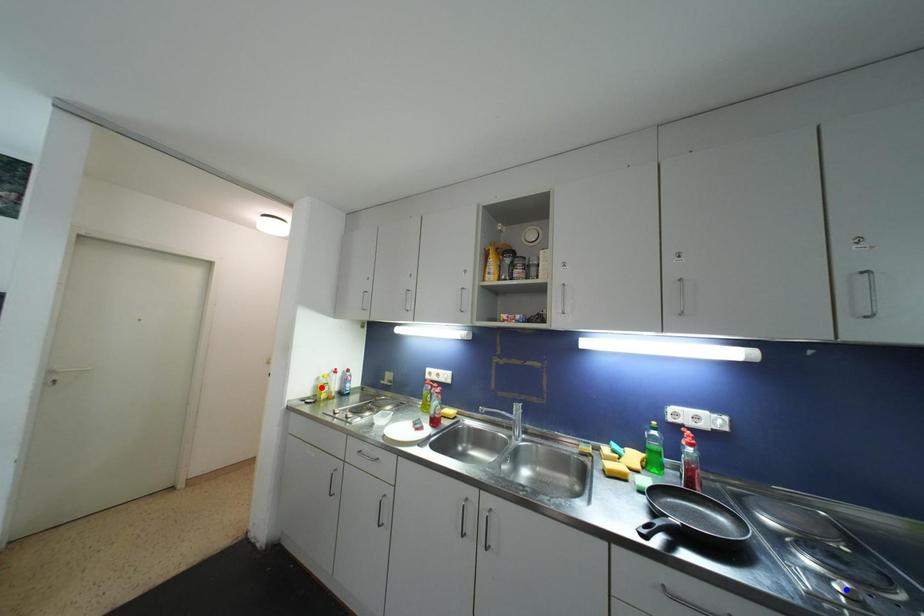
Question: Which of the two points in the image is closer to the camera?

Choices:
 (A) Blue point is closer.
 (B) Red point is closer.

Answer: (A)